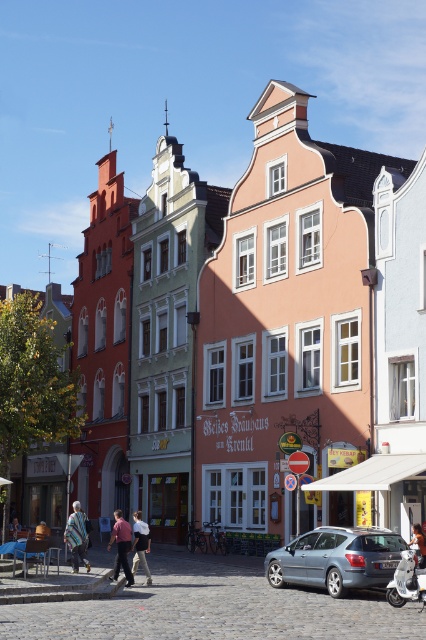
Question: Estimate the real-world distances between objects in this image. Which object is closer to the matte pink building at center?

Choices:
 (A) light brown leather jacket at center
 (B) striped woolen scarf at lower left
 (C) white cotton shirt at center

Answer: (C)

Question: Which point is closer to the camera?

Choices:
 (A) (422, 564)
 (B) (14, 538)

Answer: (A)

Question: Is matte pink building at center positioned in front of metallic silver hatchback at lower center?

Choices:
 (A) no
 (B) yes

Answer: (A)

Question: Which object appears farthest from the camera in this image?

Choices:
 (A) pink fabric shirt at center
 (B) light brown leather jacket at center

Answer: (B)

Question: Where is striped woolen scarf at lower left located in relation to light brown leather jacket at center in the image?

Choices:
 (A) below
 (B) above

Answer: (B)

Question: Considering the relative positions of cobblestone street at center and white cotton shirt at center in the image provided, where is cobblestone street at center located with respect to white cotton shirt at center?

Choices:
 (A) left
 (B) right

Answer: (B)